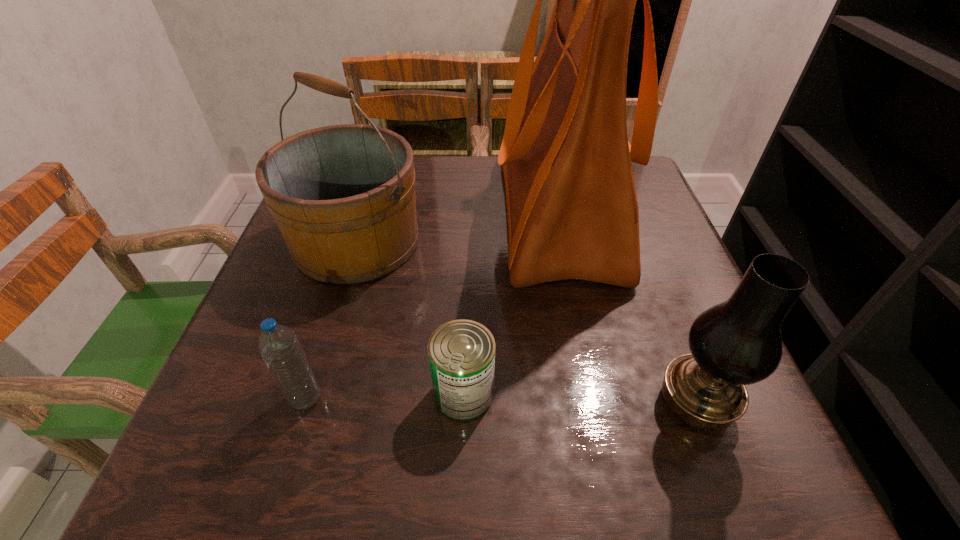
Locate an element on the screen. This screenshot has height=540, width=960. vacant space that is in between the water bottle and the bucket is located at coordinates pos(331,320).

The height and width of the screenshot is (540, 960). I want to click on vacant space that is in between the third object from left to right and the bucket, so click(x=410, y=318).

Identify the location of free spot between the oil lamp and the third object from right to left. This screenshot has height=540, width=960. (580, 399).

The width and height of the screenshot is (960, 540). In order to click on vacant area that lies between the oil lamp and the tallest object in this screenshot , I will do `click(626, 308)`.

Where is `vacant space that's between the water bottle and the shopping bag`? vacant space that's between the water bottle and the shopping bag is located at coordinates (432, 305).

You are a GUI agent. You are given a task and a screenshot of the screen. Output one action in this format:
    pyautogui.click(x=<x>, y=<y>)
    Task: Click on the vacant area between the oil lamp and the second shortest object
    
    Given the screenshot: What is the action you would take?
    pyautogui.click(x=501, y=401)

Identify the location of empty space that is in between the fourth shortest object and the third object from left to right. This screenshot has width=960, height=540. (410, 318).

Locate an element on the screen. vacant region between the third object from left to right and the third shortest object is located at coordinates (580, 399).

You are a GUI agent. You are given a task and a screenshot of the screen. Output one action in this format:
    pyautogui.click(x=<x>, y=<y>)
    Task: Click on the unoccupied position between the second tallest object and the shopping bag
    
    Given the screenshot: What is the action you would take?
    pyautogui.click(x=457, y=227)

Locate an element on the screen. This screenshot has height=540, width=960. vacant region between the shopping bag and the can is located at coordinates (511, 303).